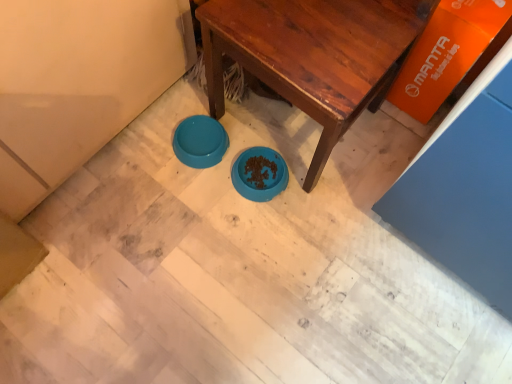
You are a GUI agent. You are given a task and a screenshot of the screen. Output one action in this format:
    pyautogui.click(x=<x>, y=<y>)
    Task: Click on the free space in front of teal plastic bowl at center
    This screenshot has width=512, height=384.
    Given the screenshot: What is the action you would take?
    pyautogui.click(x=187, y=197)